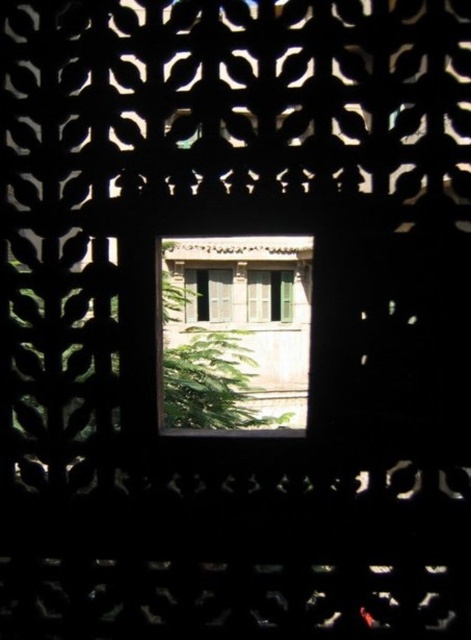
Does wooden window at center have a lesser width compared to green matte door at center?

Incorrect, wooden window at center's width is not less than green matte door at center's.

Which of these two, wooden window at center or green matte door at center, stands shorter?

With less height is green matte door at center.

I want to click on wooden window at center, so pyautogui.click(x=235, y=332).

What do you see at coordinates (235, 332) in the screenshot?
I see `wooden window at center` at bounding box center [235, 332].

Which is in front, point (242, 324) or point (202, 282)?

Point (202, 282) is more forward.

Where is `wooden window at center`? The image size is (471, 640). wooden window at center is located at coordinates (235, 332).

Which is below, green matte window at center or green matte door at center?

green matte door at center

Is green matte window at center further to the viewer compared to green matte door at center?

No, green matte window at center is in front of green matte door at center.

What are the coordinates of `green matte window at center` in the screenshot? It's located at (209, 294).

At what (x,y) coordinates should I click in order to perform the action: click on green matte window at center. Please return your answer as a coordinate pair (x, y). Looking at the image, I should click on (209, 294).